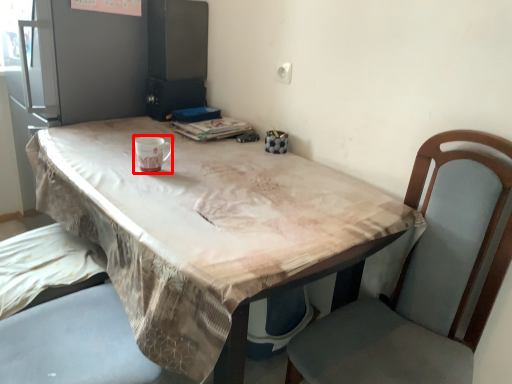
Question: From the image's perspective, considering the relative positions of mug (annotated by the red box) and table in the image provided, where is mug (annotated by the red box) located with respect to the staircase?

Choices:
 (A) above
 (B) below

Answer: (A)